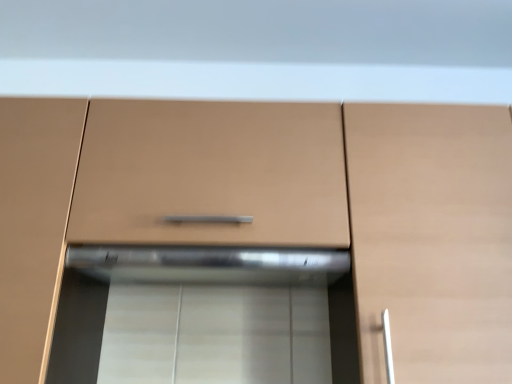
Question: Which direction should I rotate to look at matte wood cabinet at center, the 2th cabinetry viewed from the right, — up or down?

Choices:
 (A) down
 (B) up

Answer: (A)

Question: Is matte wood cabinet at right, the second cabinetry from the left, smaller than matte wood cabinet at center, the 2th cabinetry viewed from the right?

Choices:
 (A) no
 (B) yes

Answer: (A)

Question: From the image's perspective, is matte wood cabinet at right, which is the first cabinetry in right-to-left order, on matte wood cabinet at center, which is the first cabinetry in left-to-right order?

Choices:
 (A) no
 (B) yes

Answer: (A)

Question: Is matte wood cabinet at right, the second cabinetry from the left, aimed at matte wood cabinet at center, which is the first cabinetry in left-to-right order?

Choices:
 (A) no
 (B) yes

Answer: (A)

Question: Is matte wood cabinet at right, which is the first cabinetry in right-to-left order, facing away from matte wood cabinet at center, the 2th cabinetry viewed from the right?

Choices:
 (A) no
 (B) yes

Answer: (A)

Question: From a real-world perspective, does matte wood cabinet at right, which is the first cabinetry in right-to-left order, sit lower than matte wood cabinet at center, the 2th cabinetry viewed from the right?

Choices:
 (A) no
 (B) yes

Answer: (A)

Question: From a real-world perspective, is matte wood cabinet at right, which is the first cabinetry in right-to-left order, physically above matte wood cabinet at center, the 2th cabinetry viewed from the right?

Choices:
 (A) no
 (B) yes

Answer: (B)

Question: Is matte wood cabinet at center, the 2th cabinetry viewed from the right, positioned before matte wood cabinet at right, the second cabinetry from the left?

Choices:
 (A) no
 (B) yes

Answer: (B)

Question: From the image's perspective, would you say matte wood cabinet at center, the 2th cabinetry viewed from the right, is positioned over matte wood cabinet at right, which is the first cabinetry in right-to-left order?

Choices:
 (A) no
 (B) yes

Answer: (B)

Question: Does matte wood cabinet at center, the 2th cabinetry viewed from the right, appear on the left side of matte wood cabinet at right, which is the first cabinetry in right-to-left order?

Choices:
 (A) no
 (B) yes

Answer: (B)

Question: Is matte wood cabinet at center, which is the first cabinetry in left-to-right order, taller than matte wood cabinet at right, which is the first cabinetry in right-to-left order?

Choices:
 (A) no
 (B) yes

Answer: (B)

Question: Is matte wood cabinet at center, the 2th cabinetry viewed from the right, completely or partially outside of matte wood cabinet at right, which is the first cabinetry in right-to-left order?

Choices:
 (A) no
 (B) yes

Answer: (B)

Question: Are matte wood cabinet at center, which is the first cabinetry in left-to-right order, and matte wood cabinet at right, the second cabinetry from the left, far apart?

Choices:
 (A) yes
 (B) no

Answer: (B)

Question: Could matte brown drawer at center be considered to be inside matte wood cabinet at right, which is the first cabinetry in right-to-left order?

Choices:
 (A) no
 (B) yes

Answer: (A)